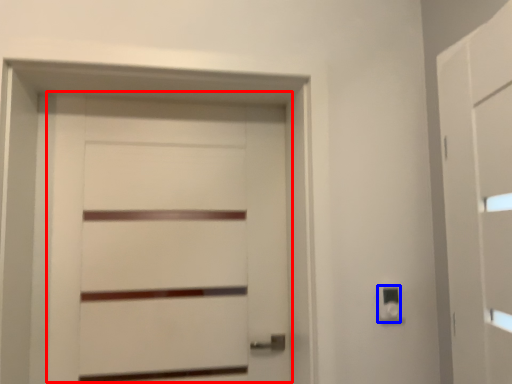
Question: Which object is closer to the camera taking this photo, door (highlighted by a red box) or light switch (highlighted by a blue box)?

Choices:
 (A) door
 (B) light switch

Answer: (B)